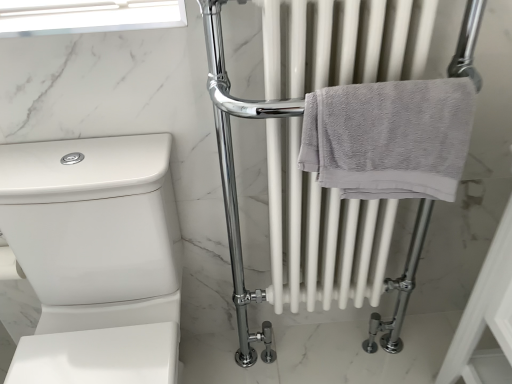
Identify the location of vacant space situated above transparent glass window screen at upper left (from a real-world perspective). (73, 21).